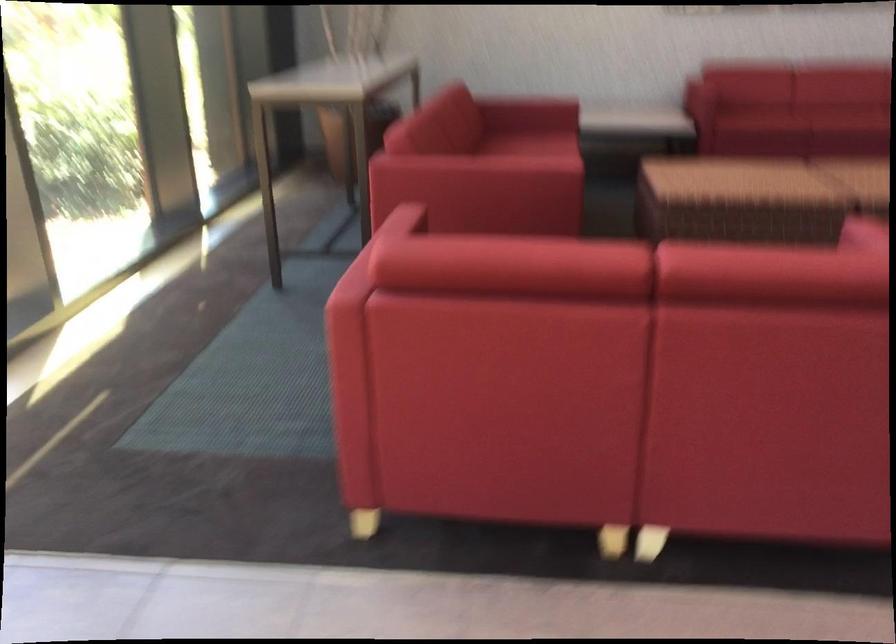
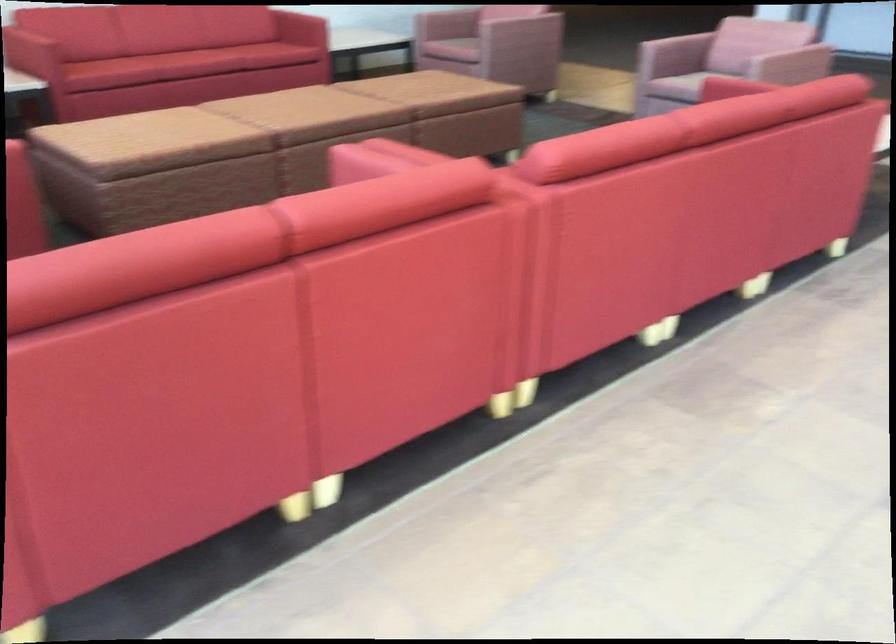
Question: What movement of the cameraman would produce the second image?

Choices:
 (A) Left
 (B) Right
 (C) Forward
 (D) Backward

Answer: (D)